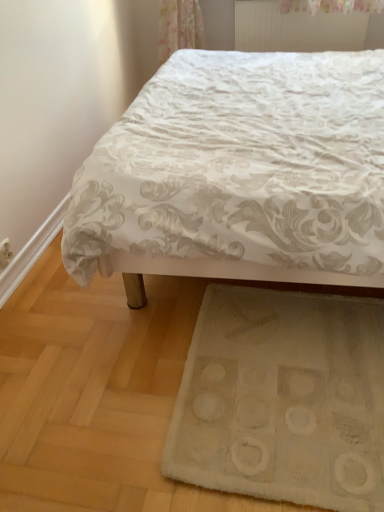
Question: Does white textured radiator at upper center appear on the right side of white textured bed at center?

Choices:
 (A) yes
 (B) no

Answer: (A)

Question: Can white textured bed at center be found inside white textured radiator at upper center?

Choices:
 (A) yes
 (B) no

Answer: (B)

Question: Can you confirm if white textured radiator at upper center is positioned to the left of white textured bed at center?

Choices:
 (A) yes
 (B) no

Answer: (B)

Question: Is white textured radiator at upper center wider than white textured bed at center?

Choices:
 (A) no
 (B) yes

Answer: (A)

Question: From the image's perspective, is white textured radiator at upper center located above white textured bed at center?

Choices:
 (A) no
 (B) yes

Answer: (B)

Question: From a real-world perspective, is white textured radiator at upper center positioned under white textured bed at center based on gravity?

Choices:
 (A) no
 (B) yes

Answer: (A)

Question: From a real-world perspective, is white textured radiator at upper center positioned under white soft rug at lower center based on gravity?

Choices:
 (A) yes
 (B) no

Answer: (B)

Question: Can you confirm if white textured radiator at upper center is smaller than white soft rug at lower center?

Choices:
 (A) no
 (B) yes

Answer: (B)

Question: Does white textured radiator at upper center have a greater width compared to white soft rug at lower center?

Choices:
 (A) yes
 (B) no

Answer: (B)

Question: Considering the relative sizes of white textured radiator at upper center and white soft rug at lower center in the image provided, is white textured radiator at upper center taller than white soft rug at lower center?

Choices:
 (A) no
 (B) yes

Answer: (B)

Question: Is white textured radiator at upper center surrounding white soft rug at lower center?

Choices:
 (A) no
 (B) yes

Answer: (A)

Question: Are white textured radiator at upper center and white soft rug at lower center beside each other?

Choices:
 (A) yes
 (B) no

Answer: (B)

Question: Considering the relative sizes of white soft rug at lower center and white textured bed at center in the image provided, is white soft rug at lower center thinner than white textured bed at center?

Choices:
 (A) yes
 (B) no

Answer: (A)